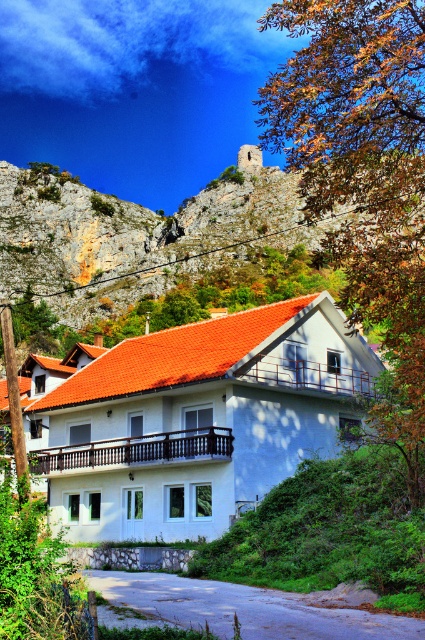
You are standing at the viewpoint of the image and want to place a small garden gnome between the two points, point (388, 106) and point (124, 211). Which point should the gnome be closer to in order to be nearer to the viewer?

The gnome should be closer to point (388, 106) because it is closer to the viewer than point (124, 211).

From the picture: You are an architect designing a new garden layout for the property. You need to decide where to place a large decorative fountain. Considering the existing brown leafy tree at upper right and rustic stone wall at upper center, which object should the fountain be placed closer to if you want it to be more prominent in the scene?

The fountain should be placed closer to the brown leafy tree at upper right because it has a larger size compared to the rustic stone wall at upper center, making it a more dominant feature in the scene.

You are standing on the paved road in front of the two story white building. You see the brown leafy tree at upper right and the rustic stone wall at upper center. Which object is higher in the image?

The brown leafy tree at upper right is taller than the rustic stone wall at upper center, so the brown leafy tree at upper right is higher in the image.